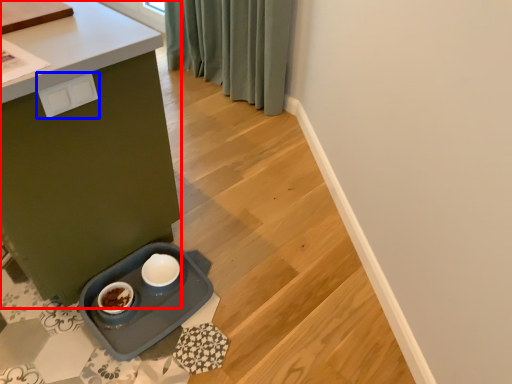
Question: Among these objects, which one is farthest to the camera, table (highlighted by a red box) or drawer (highlighted by a blue box)?

Choices:
 (A) table
 (B) drawer

Answer: (B)